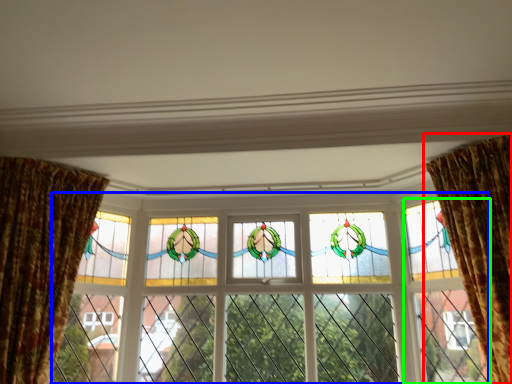
Question: Estimate the real-world distances between objects in this image. Which object is closer to curtain (highlighted by a red box), window (highlighted by a blue box) or glass door (highlighted by a green box)?

Choices:
 (A) window
 (B) glass door

Answer: (B)